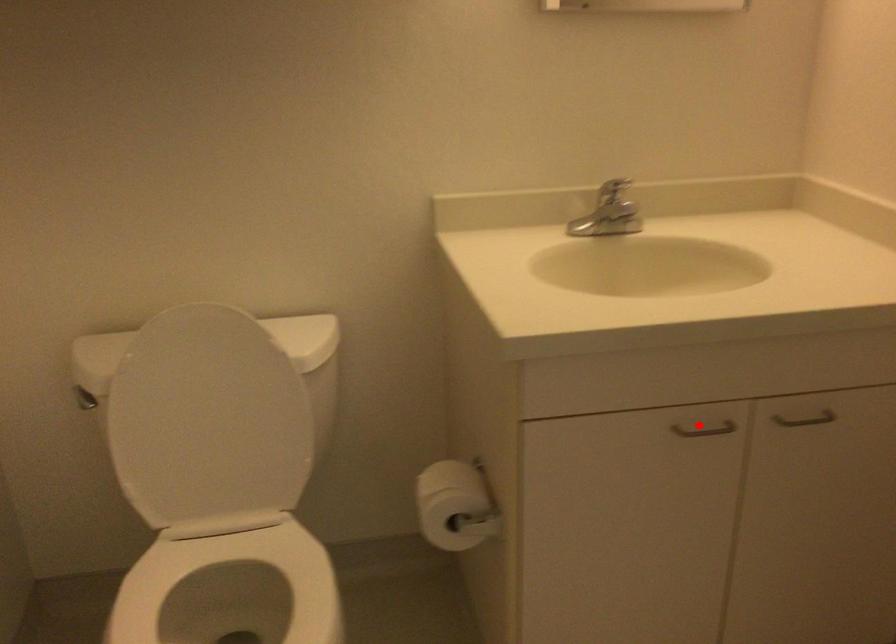
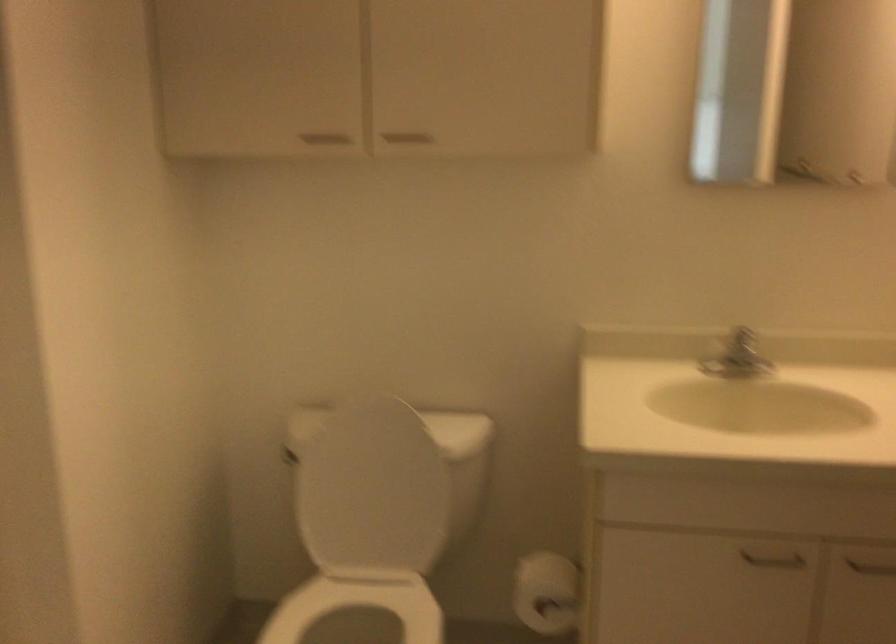
Find the pixel in the second image that matches the highlighted location in the first image.

(771, 558)